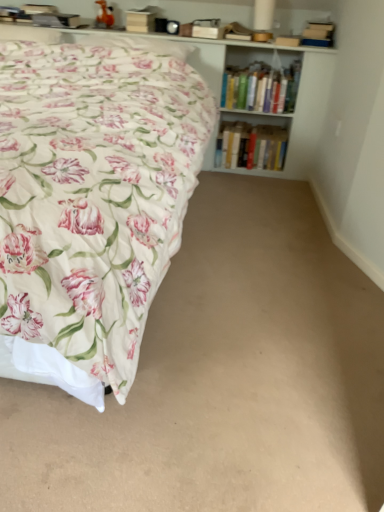
Question: Does hardcover books at upper right, the 1th book viewed from the top, have a larger size compared to white wooden bookcase at upper center?

Choices:
 (A) yes
 (B) no

Answer: (B)

Question: Considering the relative sizes of hardcover books at upper right, which appears as the 2th book when ordered from the bottom, and white wooden bookcase at upper center in the image provided, is hardcover books at upper right, which appears as the 2th book when ordered from the bottom, taller than white wooden bookcase at upper center?

Choices:
 (A) yes
 (B) no

Answer: (B)

Question: Is hardcover books at upper right, which appears as the 2th book when ordered from the bottom, to the left of white wooden bookcase at upper center from the viewer's perspective?

Choices:
 (A) no
 (B) yes

Answer: (A)

Question: From the image's perspective, is hardcover books at upper right, which appears as the 2th book when ordered from the bottom, on white wooden bookcase at upper center?

Choices:
 (A) no
 (B) yes

Answer: (B)

Question: Is hardcover books at upper right, which appears as the 2th book when ordered from the bottom, not close to white wooden bookcase at upper center?

Choices:
 (A) yes
 (B) no

Answer: (B)

Question: Would you say hardcover books at center, the second book from the top, is inside or outside beige carpet at lower center?

Choices:
 (A) outside
 (B) inside

Answer: (A)

Question: Based on their sizes in the image, would you say hardcover books at center, the second book from the top, is bigger or smaller than beige carpet at lower center?

Choices:
 (A) small
 (B) big

Answer: (A)

Question: From a real-world perspective, is hardcover books at center, positioned as the first book in bottom-to-top order, above or below beige carpet at lower center?

Choices:
 (A) below
 (B) above

Answer: (B)

Question: Considering the positions of hardcover books at center, positioned as the first book in bottom-to-top order, and beige carpet at lower center in the image, is hardcover books at center, positioned as the first book in bottom-to-top order, taller or shorter than beige carpet at lower center?

Choices:
 (A) tall
 (B) short

Answer: (A)

Question: From a real-world perspective, relative to hardcover books at center, the second book from the top, is white wooden bookcase at upper center vertically above or below?

Choices:
 (A) above
 (B) below

Answer: (A)

Question: Looking at their shapes, would you say white wooden bookcase at upper center is wider or thinner than hardcover books at center, positioned as the first book in bottom-to-top order?

Choices:
 (A) wide
 (B) thin

Answer: (A)

Question: In the image, is white wooden bookcase at upper center on the left side or the right side of hardcover books at center, positioned as the first book in bottom-to-top order?

Choices:
 (A) left
 (B) right

Answer: (A)

Question: From the image's perspective, is white wooden bookcase at upper center above or below hardcover books at center, the second book from the top?

Choices:
 (A) above
 (B) below

Answer: (A)

Question: In terms of width, does floral cotton bed at left look wider or thinner when compared to hardcover books at center, the second book from the top?

Choices:
 (A) thin
 (B) wide

Answer: (B)

Question: Is floral cotton bed at left situated inside hardcover books at center, positioned as the first book in bottom-to-top order, or outside?

Choices:
 (A) inside
 (B) outside

Answer: (B)